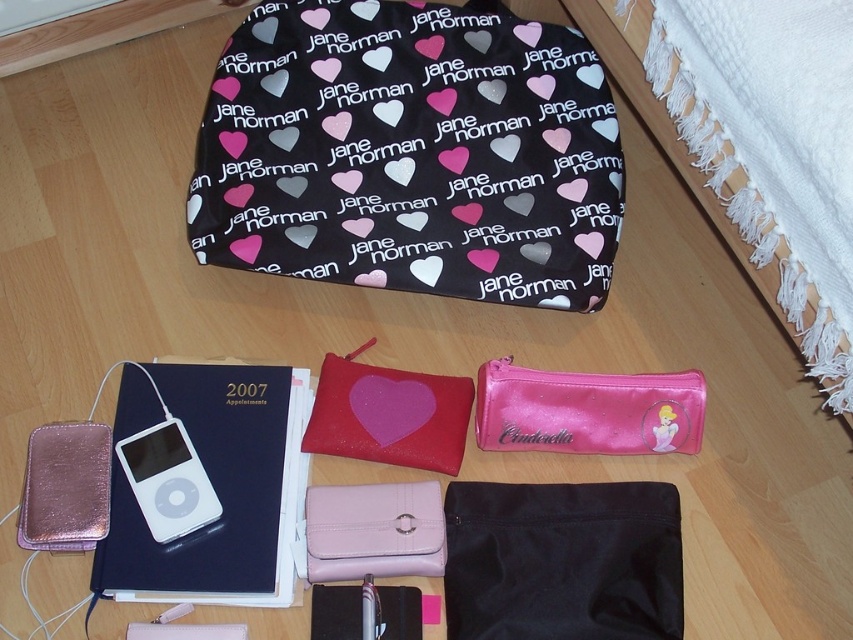
Question: Which of the following is the closest to the observer?

Choices:
 (A) pink leather wallet at center
 (B) white glossy ipod at bottom left
 (C) black fabric pouch at lower center

Answer: (C)

Question: Estimate the real-world distances between objects in this image. Which object is farther from the pink glitter pouch at lower right?

Choices:
 (A) pink fabric bed at lower right
 (B) pink glittery heart at center
 (C) black fabric pouch at lower center

Answer: (A)

Question: Which point is closer to the camera?

Choices:
 (A) pink glittery heart at center
 (B) black fabric bag at upper center
 (C) white glossy ipod at bottom left

Answer: (C)

Question: Does pink leather pouch at center have a smaller size compared to pink glittery heart at center?

Choices:
 (A) yes
 (B) no

Answer: (B)

Question: Can you confirm if black fabric pouch at lower center is positioned below matte pink fabric pouch at center?

Choices:
 (A) no
 (B) yes

Answer: (B)

Question: Is matte pink fabric pouch at center to the right of white glossy ipod at bottom left from the viewer's perspective?

Choices:
 (A) no
 (B) yes

Answer: (B)